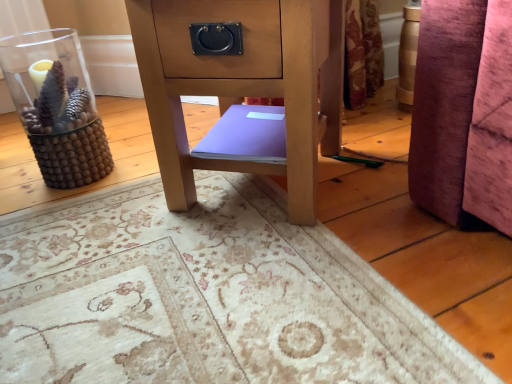
Question: Is transparent glass vase at left turned away from purple matte book at center?

Choices:
 (A) yes
 (B) no

Answer: (B)

Question: Considering the relative positions of transparent glass vase at left and purple matte book at center in the image provided, is transparent glass vase at left to the left of purple matte book at center from the viewer's perspective?

Choices:
 (A) yes
 (B) no

Answer: (A)

Question: From the image's perspective, would you say transparent glass vase at left is shown under purple matte book at center?

Choices:
 (A) yes
 (B) no

Answer: (B)

Question: Is transparent glass vase at left located outside purple matte book at center?

Choices:
 (A) yes
 (B) no

Answer: (A)

Question: Is transparent glass vase at left behind purple matte book at center?

Choices:
 (A) yes
 (B) no

Answer: (A)

Question: From the image's perspective, is purple matte book at center located above or below matte wood side table at center?

Choices:
 (A) above
 (B) below

Answer: (B)

Question: Would you say purple matte book at center is inside or outside matte wood side table at center?

Choices:
 (A) inside
 (B) outside

Answer: (A)

Question: Visually, is purple matte book at center positioned to the left or to the right of matte wood side table at center?

Choices:
 (A) left
 (B) right

Answer: (A)

Question: Looking at the image, does purple matte book at center seem bigger or smaller compared to matte wood side table at center?

Choices:
 (A) big
 (B) small

Answer: (B)

Question: Considering the positions of point (310, 142) and point (23, 64), is point (310, 142) closer or farther from the camera than point (23, 64)?

Choices:
 (A) closer
 (B) farther

Answer: (A)

Question: Considering the relative positions of matte wood side table at center and transparent glass vase at left in the image provided, is matte wood side table at center to the left or to the right of transparent glass vase at left?

Choices:
 (A) right
 (B) left

Answer: (A)

Question: Considering the positions of matte wood side table at center and transparent glass vase at left in the image, is matte wood side table at center wider or thinner than transparent glass vase at left?

Choices:
 (A) thin
 (B) wide

Answer: (B)

Question: Is matte wood side table at center inside or outside of transparent glass vase at left?

Choices:
 (A) inside
 (B) outside

Answer: (B)

Question: Considering the positions of point (333, 11) and point (283, 119), is point (333, 11) closer or farther from the camera than point (283, 119)?

Choices:
 (A) closer
 (B) farther

Answer: (A)

Question: Looking at the image, does matte wood side table at center seem bigger or smaller compared to purple matte book at center?

Choices:
 (A) big
 (B) small

Answer: (A)